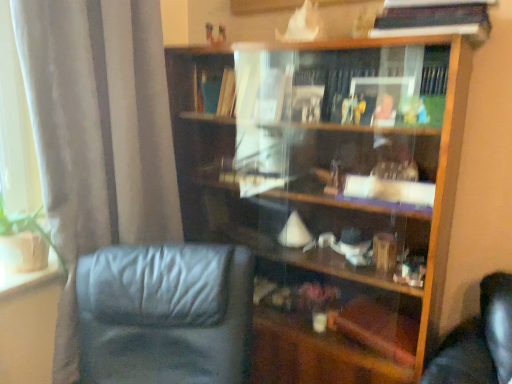
Question: From the image's perspective, does wooden bookcase at center appear lower than hardcover book at upper right?

Choices:
 (A) yes
 (B) no

Answer: (A)

Question: Is hardcover book at upper right located within wooden bookcase at center?

Choices:
 (A) yes
 (B) no

Answer: (B)

Question: Is wooden bookcase at center not near hardcover book at upper right?

Choices:
 (A) yes
 (B) no

Answer: (B)

Question: Can you confirm if wooden bookcase at center is wider than hardcover book at upper right?

Choices:
 (A) no
 (B) yes

Answer: (B)

Question: Does wooden bookcase at center have a larger size compared to hardcover book at upper right?

Choices:
 (A) yes
 (B) no

Answer: (A)

Question: From a real-world perspective, is wooden bookcase at center physically below hardcover book at upper right?

Choices:
 (A) yes
 (B) no

Answer: (A)

Question: Does wooden bookcase at center have a lesser height compared to black leather chair at lower left?

Choices:
 (A) no
 (B) yes

Answer: (A)

Question: Is wooden bookcase at center aimed at black leather chair at lower left?

Choices:
 (A) no
 (B) yes

Answer: (B)

Question: Considering the relative positions of wooden bookcase at center and black leather chair at lower left in the image provided, is wooden bookcase at center to the left of black leather chair at lower left from the viewer's perspective?

Choices:
 (A) yes
 (B) no

Answer: (B)

Question: From the image's perspective, would you say wooden bookcase at center is positioned over black leather chair at lower left?

Choices:
 (A) no
 (B) yes

Answer: (B)

Question: From a real-world perspective, is wooden bookcase at center located higher than black leather chair at lower left?

Choices:
 (A) yes
 (B) no

Answer: (A)

Question: Is the position of wooden bookcase at center more distant than that of black leather chair at lower left?

Choices:
 (A) no
 (B) yes

Answer: (B)

Question: Considering the relative sizes of black leather chair at lower left and hardcover book at upper right in the image provided, is black leather chair at lower left shorter than hardcover book at upper right?

Choices:
 (A) yes
 (B) no

Answer: (B)